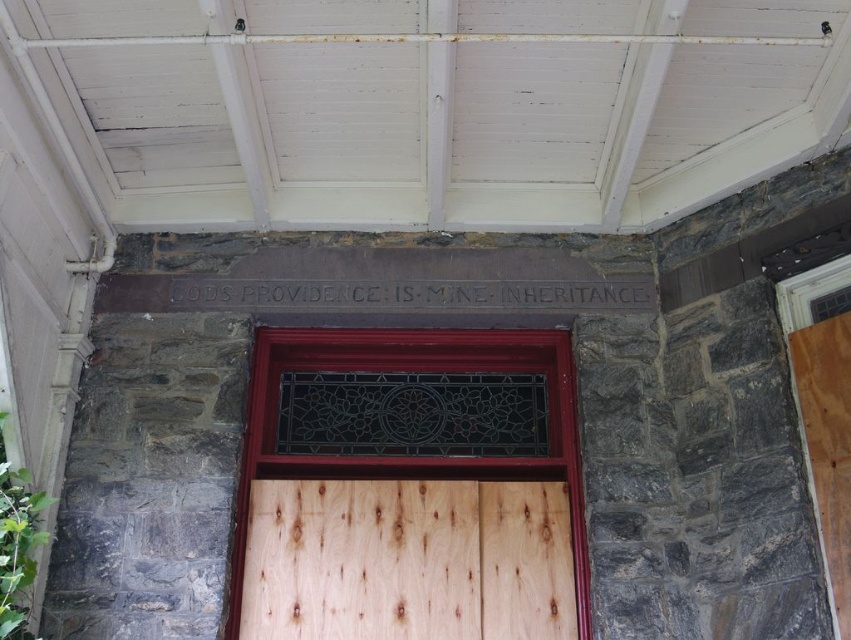
You are an architect examining the building exterior. You notice two doors labeled as wooden door at center and natural wood door at center. Which door is taller?

The wooden door at center is taller than the natural wood door at center according to the description.

You are standing in front of the building and want to enter through the wooden door at center. Based on the coordinates provided in the Objects Description, is the door positioned higher or lower than the decorative lintel above it?

The wooden door at center is located at point (850,488), which places it lower than the decorative lintel above it since the lintel is at the top of the wall.

You are a painter hired to paint the exterior of the building. You notice two doors at the center of the stone wall. Which door should you paint first, the wooden door at center or the natural wood door at center?

The wooden door at center is positioned over natural wood door at center, so you should paint the wooden door at center first to avoid getting paint on the lower door.